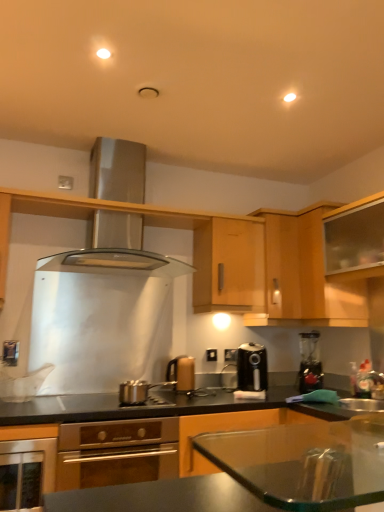
Question: From the image's perspective, relative to light wood cabinet at center, the fourth cabinetry viewed from the right, is transparent glass cabinet at upper right, marked as the fourth cabinetry in a left-to-right arrangement, above or below?

Choices:
 (A) above
 (B) below

Answer: (A)

Question: Is transparent glass cabinet at upper right, marked as the fourth cabinetry in a left-to-right arrangement, wider or thinner than light wood cabinet at center, the fourth cabinetry viewed from the right?

Choices:
 (A) wide
 (B) thin

Answer: (B)

Question: Estimate the real-world distances between objects in this image. Which object is closer to the wooden cabinet at center, which is the 3th cabinetry in right-to-left order?

Choices:
 (A) black plastic air fryer at center, marked as the first kitchen appliance in a right-to-left arrangement
 (B) satin silver exhaust hood at upper center
 (C) satin silver oven at lower center, which is the fourth kitchen appliance in right-to-left order
 (D) light wood cabinet at upper right, which is counted as the third cabinetry, starting from the left
 (E) black glossy countertop at center

Answer: (D)

Question: Estimate the real-world distances between objects in this image. Which object is closer to the matte gold kettle at center, which ranks as the second kitchen appliance in right-to-left order?

Choices:
 (A) light wood cabinet at upper right, which is counted as the third cabinetry, starting from the left
 (B) satin silver oven at lower center, which is the fourth kitchen appliance in right-to-left order
 (C) metallic silver pot at center, which is counted as the 2th kitchen appliance, starting from the left
 (D) satin silver exhaust hood at upper center
 (E) stainless steel oven at lower left

Answer: (C)